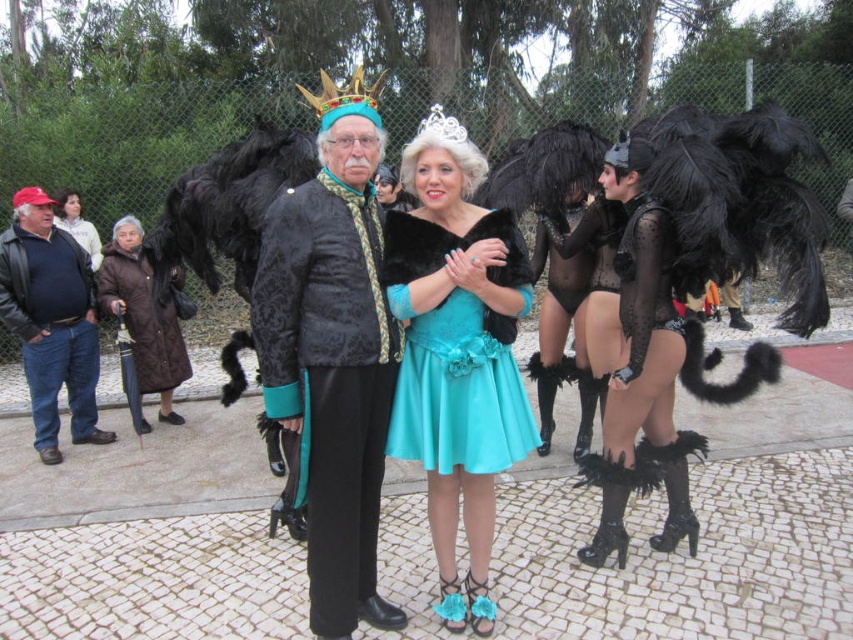
Question: Is denim jeans at left smaller than silver metallic crown at center?

Choices:
 (A) yes
 (B) no

Answer: (A)

Question: Which object appears farthest from the camera in this image?

Choices:
 (A) matte brown coat at upper left
 (B) brown quilted coat at left
 (C) denim jeans at left

Answer: (A)

Question: Which object is the farthest from the turquoise satin dress at center?

Choices:
 (A) satin teal dress at center
 (B) silver metallic crown at center

Answer: (B)

Question: Among these points, which one is farthest from the camera?

Choices:
 (A) (460, 400)
 (B) (99, 240)

Answer: (B)

Question: Is satin teal dress at center positioned before matte brown coat at upper left?

Choices:
 (A) yes
 (B) no

Answer: (A)

Question: From the image, what is the correct spatial relationship of turquoise satin dress at center in relation to gold jeweled crown at center?

Choices:
 (A) left
 (B) right

Answer: (B)